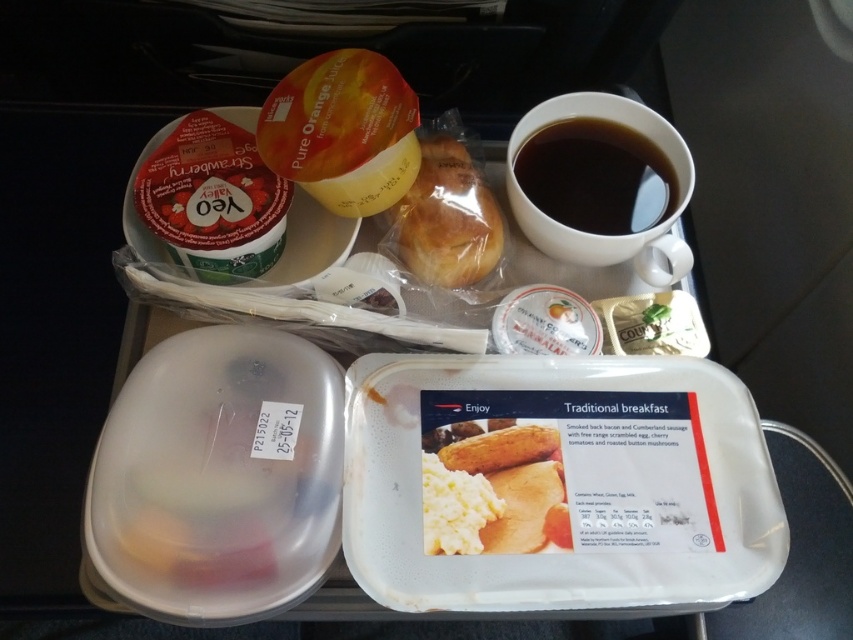
You are a flight attendant checking the meal tray. You need to place a new item between the white fluffy scrambled egg at center and the black glossy cup at upper right. Which side should you place it closer to the egg to ensure it fits?

The white fluffy scrambled egg at center has a lesser width compared to the black glossy cup at upper right. To ensure the new item fits, place it closer to the egg since it is narrower.